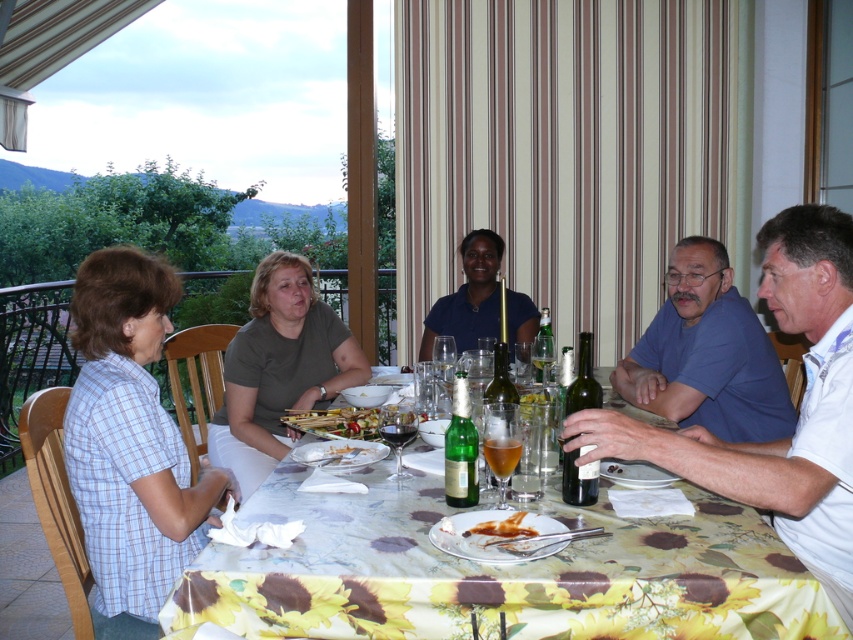
Question: Is green glass bottle at center to the right of translucent glass wine at table center from the viewer's perspective?

Choices:
 (A) no
 (B) yes

Answer: (B)

Question: Which of the following is the farthest from the observer?

Choices:
 (A) translucent glass wine at table center
 (B) dark blue shirt at center
 (C) floral-patterned tablecloth at center

Answer: (B)

Question: Based on their relative distances, which object is farther from the green glass bottle at center?

Choices:
 (A) blue cotton shirt at upper right
 (B) translucent glass wine at table center
 (C) brown crumbly bread at lower center

Answer: (A)

Question: Is floral-patterned tablecloth at center positioned in front of dark blue shirt at center?

Choices:
 (A) no
 (B) yes

Answer: (B)

Question: Is blue cotton shirt at right bigger than translucent glass wine at table center?

Choices:
 (A) no
 (B) yes

Answer: (B)

Question: Considering the real-world distances, which object is farthest from the brown crumbly bread at lower center?

Choices:
 (A) blue cotton shirt at upper right
 (B) green glass bottle at center
 (C) light blue plaid shirt at left

Answer: (A)